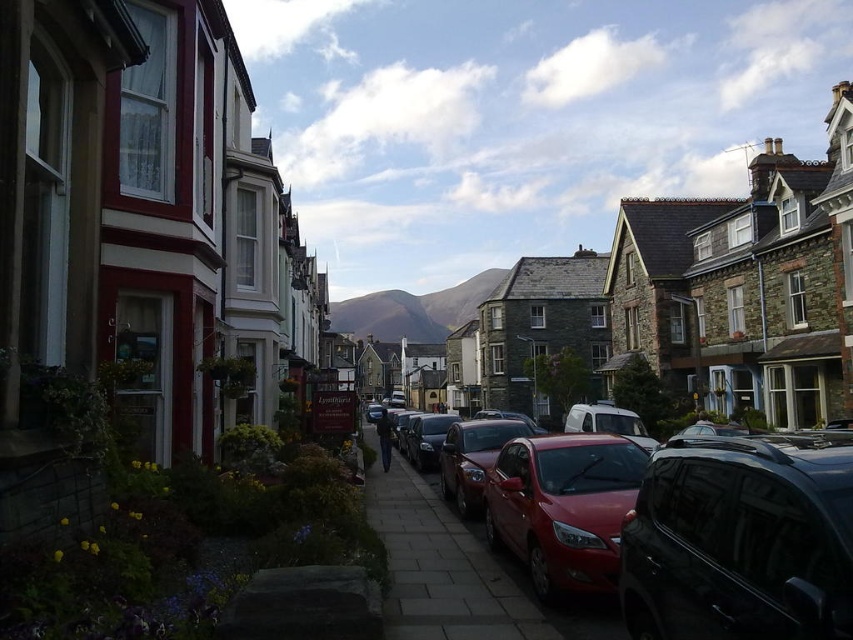
Who is shorter, glossy red car at center or shiny red car at center?

Standing shorter between the two is glossy red car at center.

Does point (569, 552) come in front of point (514, 433)?

That is True.

Find the location of a particular element. This screenshot has height=640, width=853. glossy red car at center is located at coordinates (563, 508).

Does paved stone sidewalk at center have a lesser width compared to shiny red car at center?

Incorrect, paved stone sidewalk at center's width is not less than shiny red car at center's.

Describe the element at coordinates (440, 568) in the screenshot. I see `paved stone sidewalk at center` at that location.

Where is `paved stone sidewalk at center`? The width and height of the screenshot is (853, 640). paved stone sidewalk at center is located at coordinates (440, 568).

In the scene shown: Does glossy black car at lower right appear on the right side of shiny red sedan at center?

Indeed, glossy black car at lower right is positioned on the right side of shiny red sedan at center.

Between point (770, 563) and point (534, 436), which one is positioned behind?

The point (534, 436) is behind.

Locate an element on the screen. glossy black car at lower right is located at coordinates tap(740, 541).